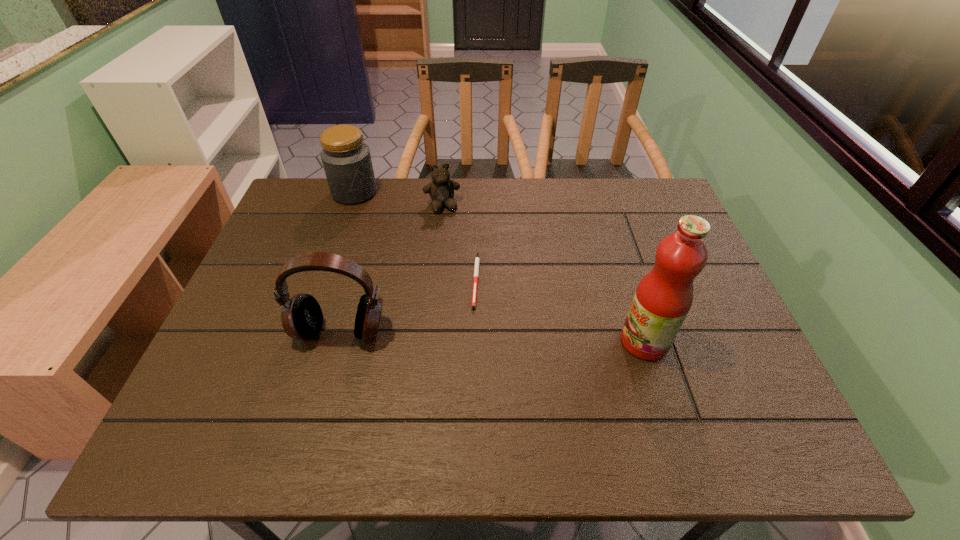
Find the location of a particular element. Image resolution: width=960 pixels, height=540 pixels. vacant area situated on the front label of the fruit juice is located at coordinates (476, 341).

At what (x,y) coordinates should I click in order to perform the action: click on free point located on the front label of the fruit juice. Please return your answer as a coordinate pair (x, y). The height and width of the screenshot is (540, 960). Looking at the image, I should click on (541, 341).

Find the location of a particular element. The image size is (960, 540). vacant space located on the face of the third object from left to right is located at coordinates tap(454, 247).

I want to click on vacant region located 0.220m on the face of the third object from left to right, so click(459, 265).

Locate an element on the screen. free space located 0.110m on the face of the third object from left to right is located at coordinates (452, 238).

At what (x,y) coordinates should I click in order to perform the action: click on free space located on the clicker of the third farthest object. Please return your answer as a coordinate pair (x, y). Looking at the image, I should click on (539, 394).

This screenshot has height=540, width=960. I want to click on vacant area situated 0.140m on the clicker of the third farthest object, so click(507, 348).

This screenshot has width=960, height=540. I want to click on blank space located on the clicker of the third farthest object, so click(x=539, y=394).

Identify the location of vacant position located 0.280m on the surface of the jar near the warning symbol. The height and width of the screenshot is (540, 960). tap(398, 257).

Locate an element on the screen. The height and width of the screenshot is (540, 960). vacant space located on the surface of the jar near the warning symbol is located at coordinates (411, 275).